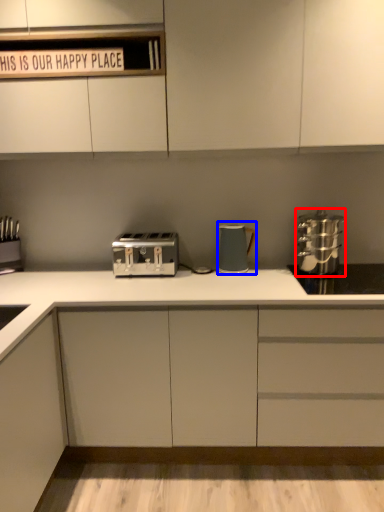
Question: Among these objects, which one is nearest to the camera, home appliance (highlighted by a red box) or kitchen appliance (highlighted by a blue box)?

Choices:
 (A) home appliance
 (B) kitchen appliance

Answer: (A)